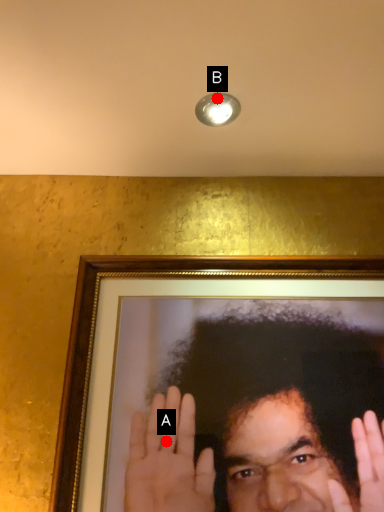
Question: Two points are circled on the image, labeled by A and B beside each circle. Which of the following is the closest to the observer?

Choices:
 (A) A is closer
 (B) B is closer

Answer: (A)